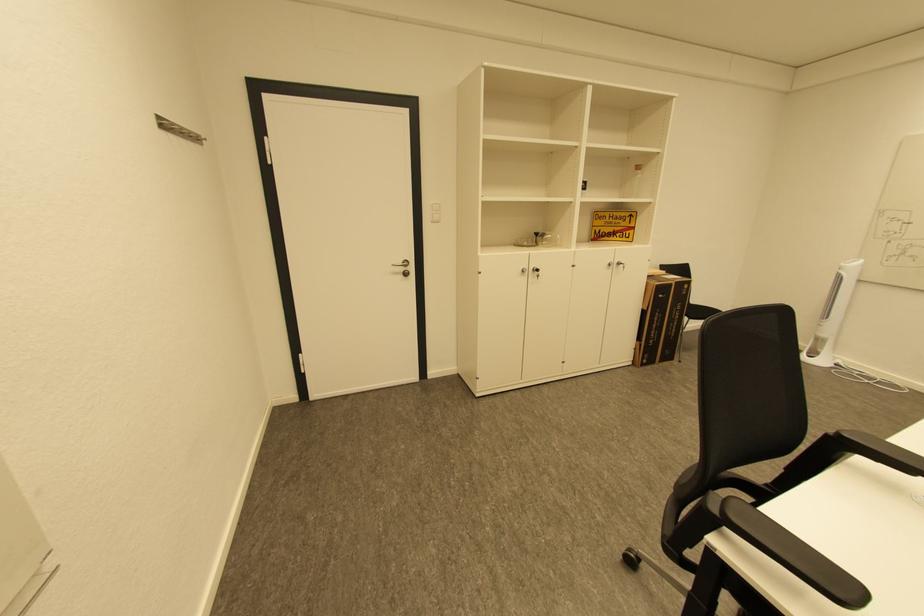
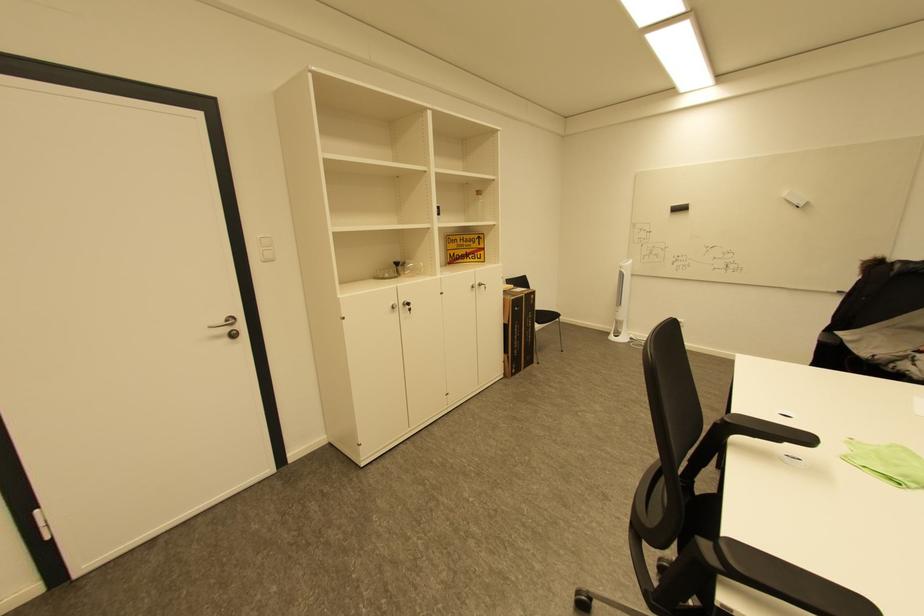
Question: Based on the continuous images, in which direction is the camera rotating? Reply with the corresponding letter.

Choices:
 (A) Left
 (B) Right
 (C) Up
 (D) Down

Answer: (B)